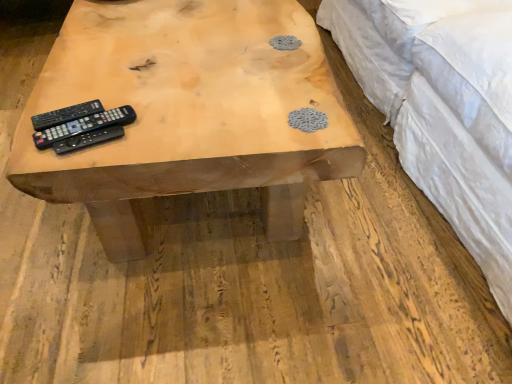
This screenshot has height=384, width=512. I want to click on vacant space in front of black plastic remote at left, which ranks as the 2th remote control in back-to-front order, so click(68, 152).